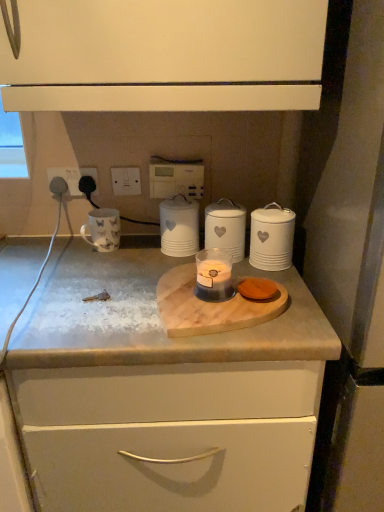
The width and height of the screenshot is (384, 512). I want to click on free location to the right of translucent glass candle at center, so click(x=294, y=305).